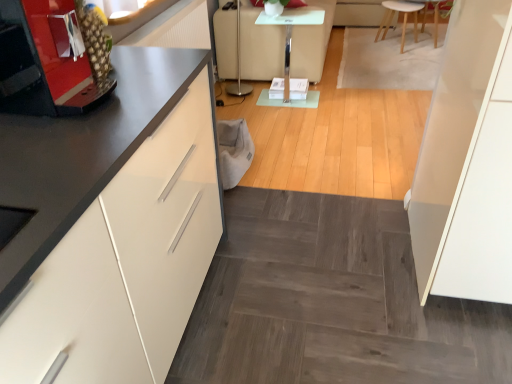
Question: Considering the positions of metallic red coffee machine at left and clear glass table at center in the image, is metallic red coffee machine at left taller or shorter than clear glass table at center?

Choices:
 (A) tall
 (B) short

Answer: (B)

Question: From the image's perspective, relative to clear glass table at center, is metallic red coffee machine at left above or below?

Choices:
 (A) below
 (B) above

Answer: (A)

Question: Which of these objects is positioned farthest from the light wood stool at upper right?

Choices:
 (A) white leather couch at center
 (B) metallic red coffee machine at left
 (C) clear glass table at center

Answer: (B)

Question: Which object is positioned closest to the white leather couch at center?

Choices:
 (A) clear glass table at center
 (B) light wood stool at upper right
 (C) metallic red coffee machine at left

Answer: (A)